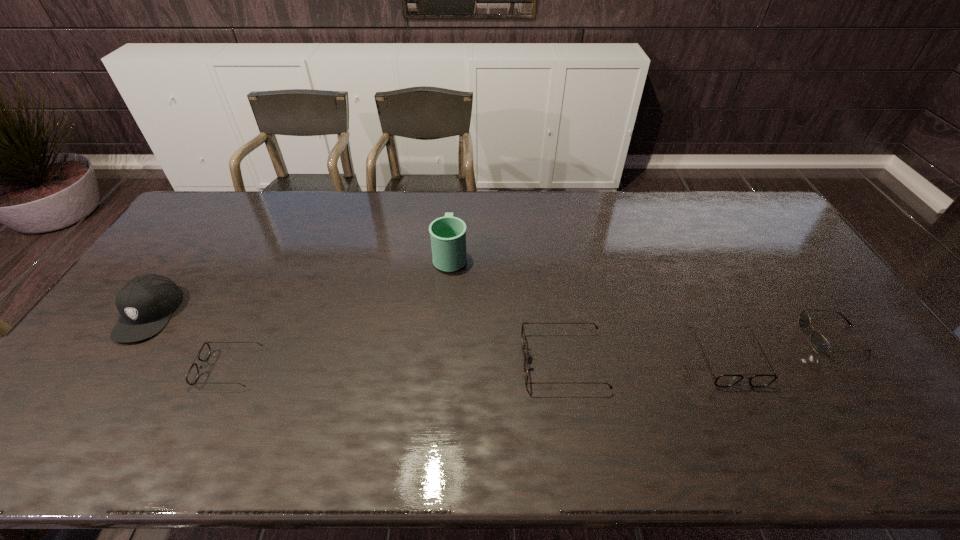
The height and width of the screenshot is (540, 960). Find the location of `vacant area that lies between the rightmost object and the second tallest object`. vacant area that lies between the rightmost object and the second tallest object is located at coordinates (491, 326).

At what (x,y) coordinates should I click in order to perform the action: click on free space that is in between the second sunglasses from right to left and the leftmost sunglasses. Please return your answer as a coordinate pair (x, y). The width and height of the screenshot is (960, 540). Looking at the image, I should click on (478, 363).

Select which object is the third closest to the third object from right to left. Please provide its 2D coordinates. Your answer should be formatted as a tuple, i.e. [(x, y)], where the tuple contains the x and y coordinates of a point satisfying the conditions above.

[(819, 343)]

I want to click on object that is the third closest to the farthest object, so click(x=726, y=380).

I want to click on the closest sunglasses relative to the mug, so click(x=523, y=331).

Select which sunglasses appears as the closest to the second sunglasses from right to left. Please provide its 2D coordinates. Your answer should be formatted as a tuple, i.e. [(x, y)], where the tuple contains the x and y coordinates of a point satisfying the conditions above.

[(819, 343)]

This screenshot has width=960, height=540. Identify the location of free location that satisfies the following two spatial constraints: 1. on the front-facing side of the second sunglasses from right to left; 2. on the front-facing side of the second object from left to right. (732, 368).

Where is `vacant space that satisfies the following two spatial constraints: 1. on the front-facing side of the second object from right to left; 2. on the front-facing side of the fifth object from right to left`? The height and width of the screenshot is (540, 960). vacant space that satisfies the following two spatial constraints: 1. on the front-facing side of the second object from right to left; 2. on the front-facing side of the fifth object from right to left is located at coordinates (732, 368).